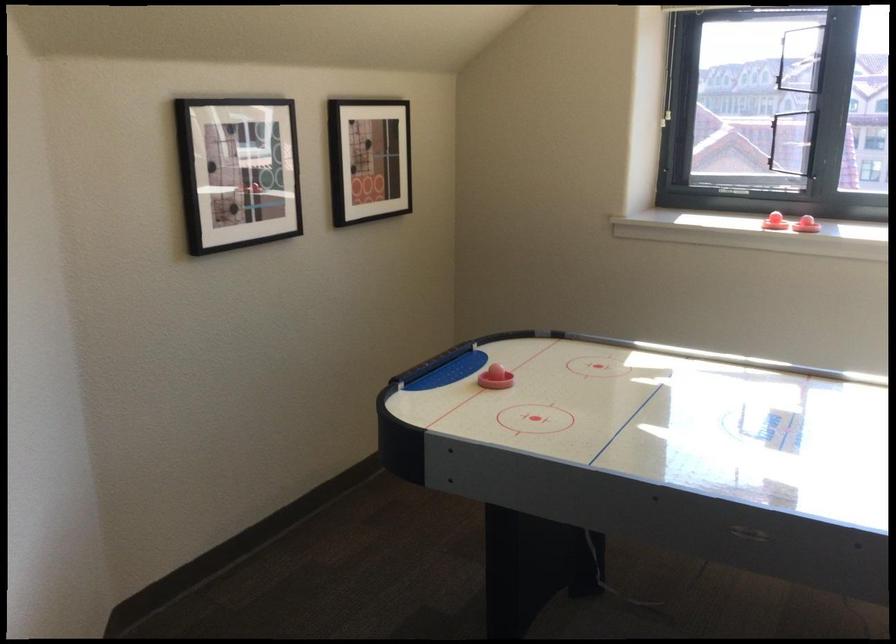
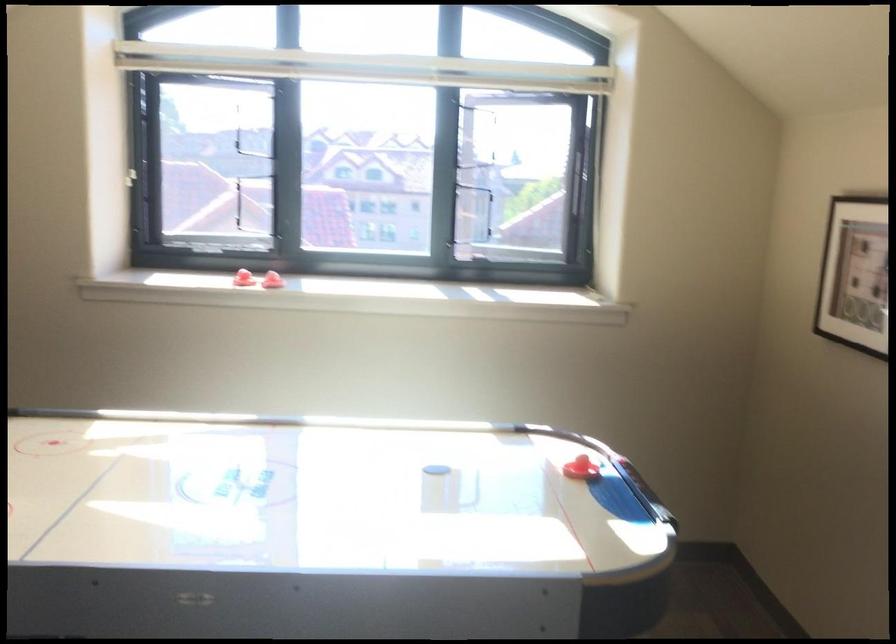
Find the pixel in the second image that matches the point at 779,214 in the first image.

(244, 279)